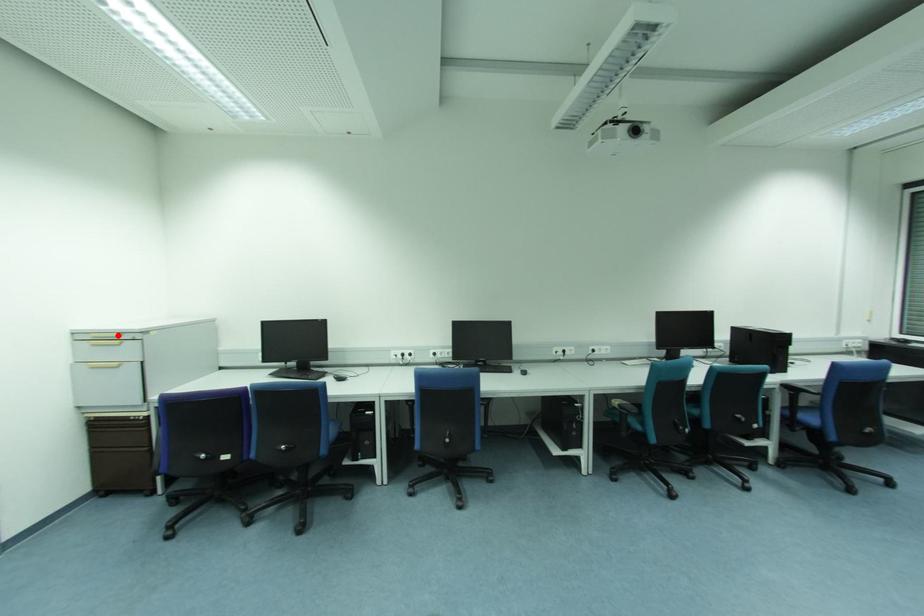
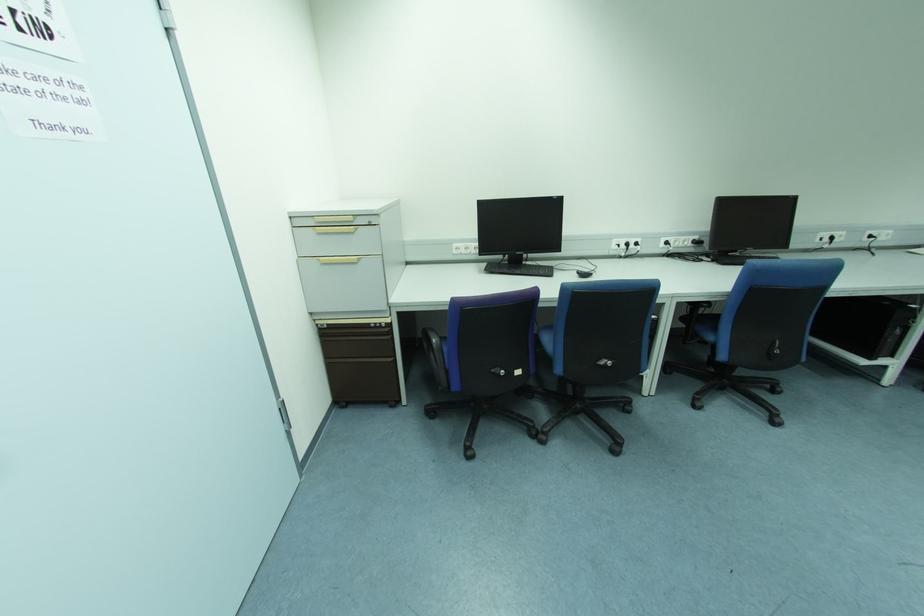
Locate, in the second image, the point that corresponds to the highlighted location in the first image.

(350, 219)